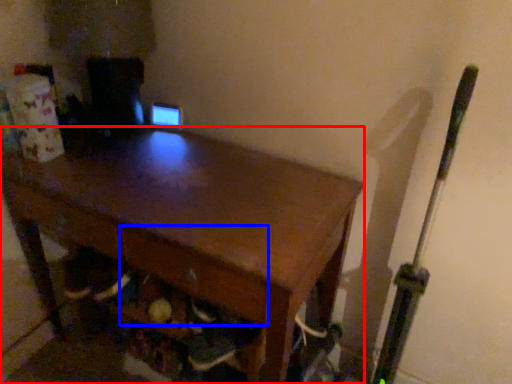
Question: Which point is further to the camera, desk (highlighted by a red box) or drawer (highlighted by a blue box)?

Choices:
 (A) desk
 (B) drawer

Answer: (B)